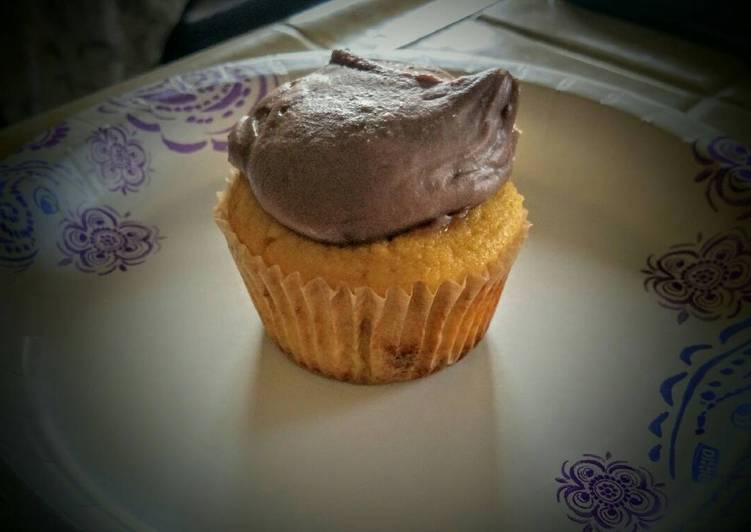
This screenshot has width=751, height=532. Identify the location of ledge of counter. (305, 16), (239, 40).